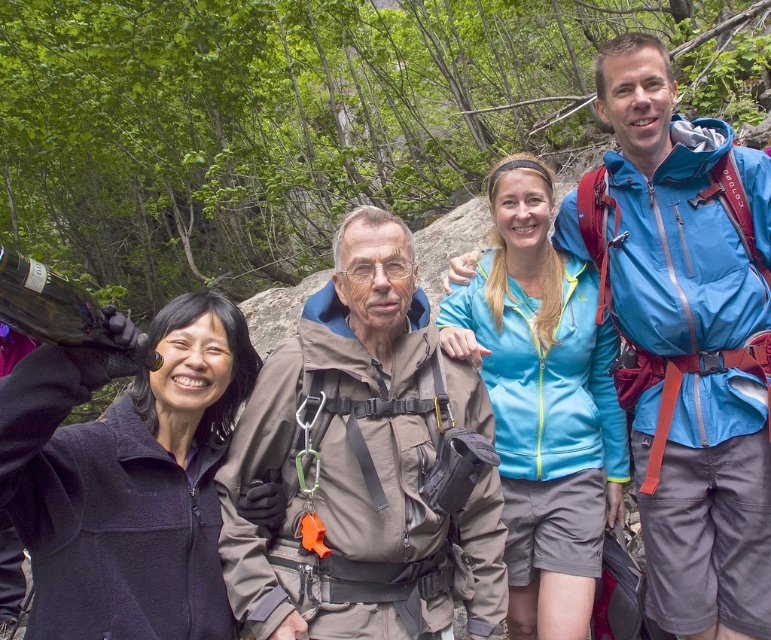
How much distance is there between blue synthetic jacket at center and dark purple fleece jacket at upper left?

blue synthetic jacket at center is 7.39 feet away from dark purple fleece jacket at upper left.

Can you confirm if blue synthetic jacket at center is wider than dark purple fleece jacket at upper left?

Yes.

I want to click on blue synthetic jacket at center, so click(x=685, y=339).

Between blue synthetic jacket at center and matte brown jacket at center, which one appears on the left side from the viewer's perspective?

From the viewer's perspective, matte brown jacket at center appears more on the left side.

The image size is (771, 640). In order to click on blue synthetic jacket at center in this screenshot , I will do click(685, 339).

From the picture: Does matte brown jacket at center have a larger size compared to dark purple fleece jacket at upper left?

Yes, matte brown jacket at center is bigger than dark purple fleece jacket at upper left.

Between matte brown jacket at center and dark purple fleece jacket at upper left, which one appears on the right side from the viewer's perspective?

matte brown jacket at center is more to the right.

Is point (365, 300) in front of point (177, 403)?

Yes.

What are the coordinates of `matte brown jacket at center` in the screenshot? It's located at (359, 467).